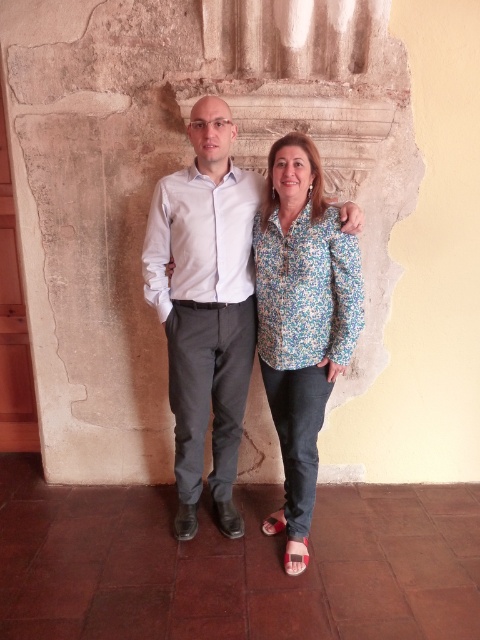
Question: Does matte white shirt at center appear on the left side of pink fabric sandal at lower center?

Choices:
 (A) no
 (B) yes

Answer: (B)

Question: Is pink fabric sandal at lower center further to the viewer compared to red fabric sandal at lower center?

Choices:
 (A) yes
 (B) no

Answer: (B)

Question: Among these objects, which one is farthest from the camera?

Choices:
 (A) red fabric sandal at lower center
 (B) matte white shirt at center
 (C) floral print blouse at center

Answer: (A)

Question: Which point appears closest to the camera in this image?

Choices:
 (A) (286, 561)
 (B) (207, 227)
 (C) (278, 520)
 (D) (310, 392)

Answer: (B)

Question: Is pink fabric sandal at lower center above red fabric sandal at lower center?

Choices:
 (A) yes
 (B) no

Answer: (B)

Question: Among these points, which one is nearest to the camera?

Choices:
 (A) (229, 140)
 (B) (264, 241)

Answer: (A)